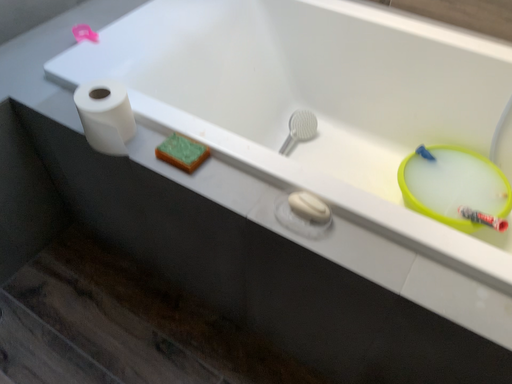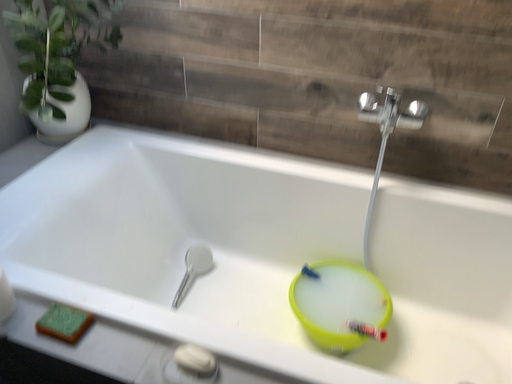
Question: How did the camera likely rotate when shooting the video?

Choices:
 (A) rotated right
 (B) rotated left

Answer: (A)